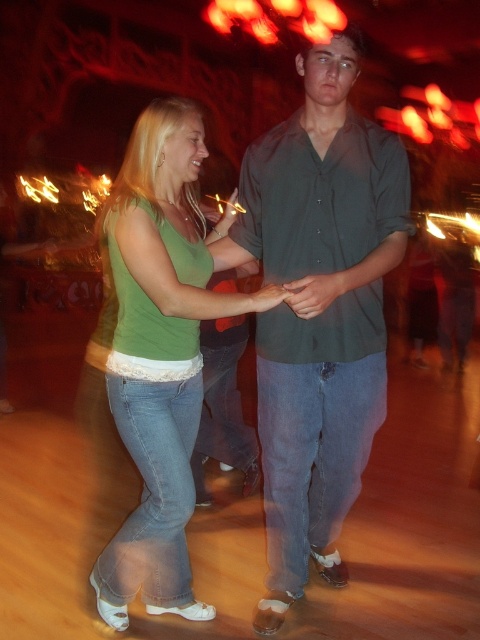
Does point (350, 44) come behind point (170, 490)?

No, it is in front of (170, 490).

Who is more distant from viewer, (312, 490) or (163, 125)?

The point (312, 490) is behind.

You are a GUI agent. You are given a task and a screenshot of the screen. Output one action in this format:
    pyautogui.click(x=<x>, y=<y>)
    Task: Click on the dark green shirt at center
    This screenshot has height=640, width=480.
    Given the screenshot: What is the action you would take?
    pyautogui.click(x=319, y=310)